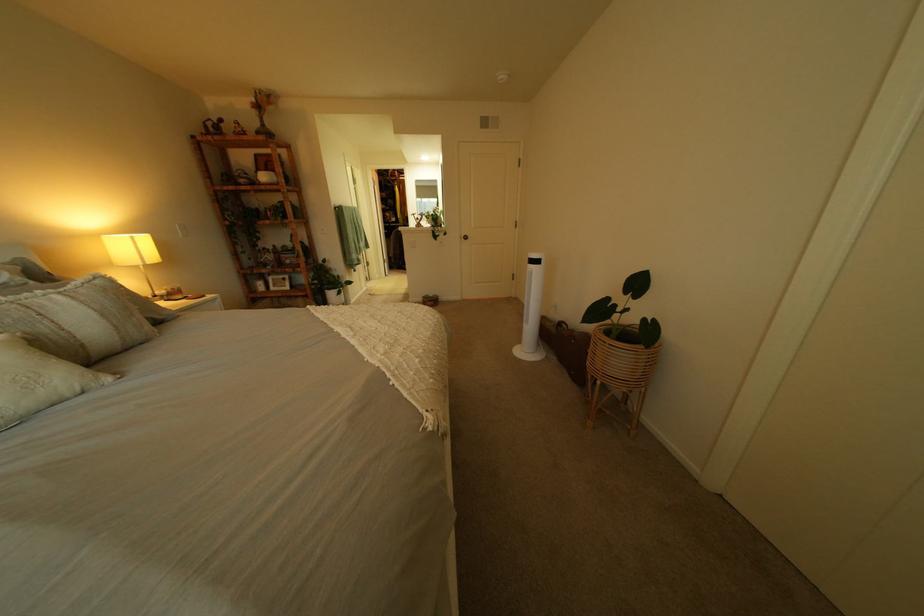
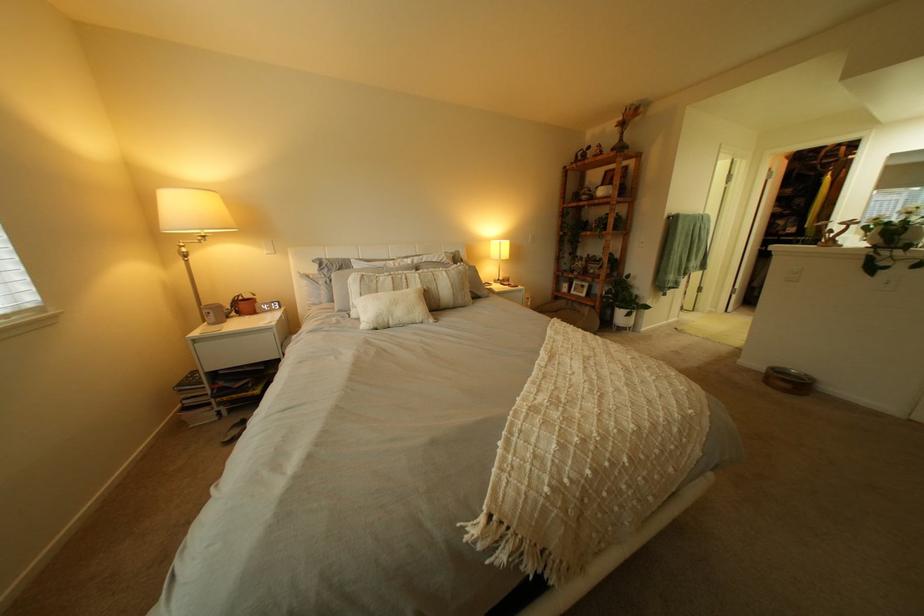
In the second image, find the point that corresponds to point 342,288 in the first image.

(633, 305)